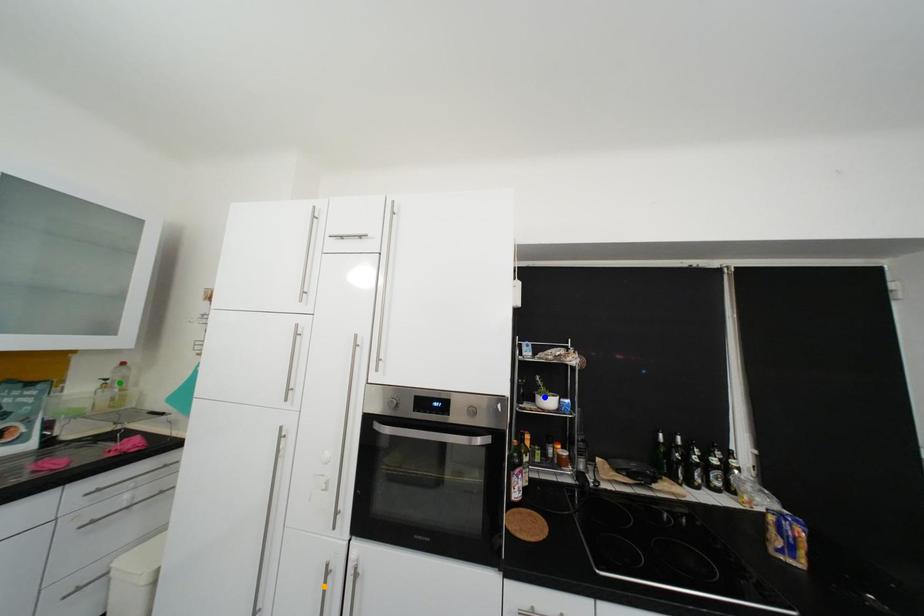
Order these from nearest to farthest:
1. orange point
2. blue point
3. green point

orange point < green point < blue point